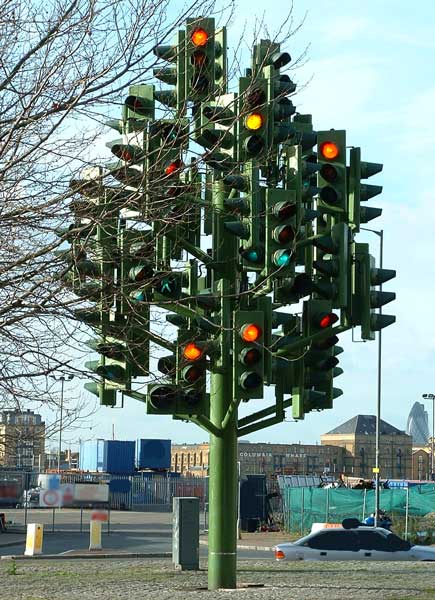
The height and width of the screenshot is (600, 435). Find the location of `yellow light`. yellow light is located at coordinates (255, 125).